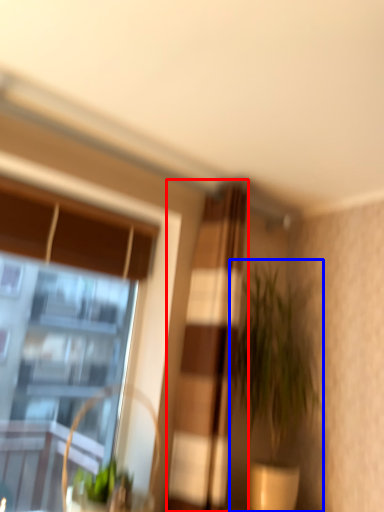
Question: Among these objects, which one is nearest to the camera, curtain (highlighted by a red box) or houseplant (highlighted by a blue box)?

Choices:
 (A) curtain
 (B) houseplant

Answer: (A)